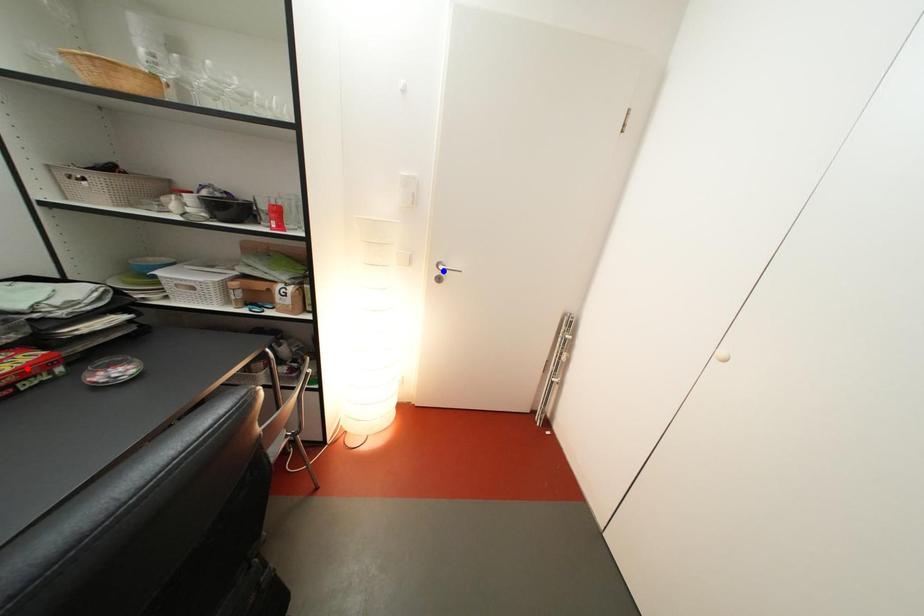
Question: In the image, two points are highlighted. Which point is nearer to the camera? Reply with the corresponding letter.

Choices:
 (A) blue point
 (B) red point

Answer: (B)